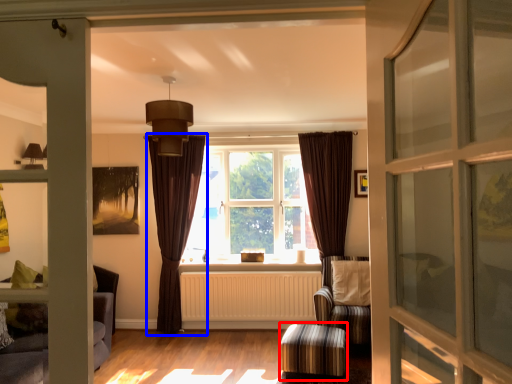
Question: Which of the following is the farthest to the observer, stool (highlighted by a red box) or curtain (highlighted by a blue box)?

Choices:
 (A) stool
 (B) curtain

Answer: (B)